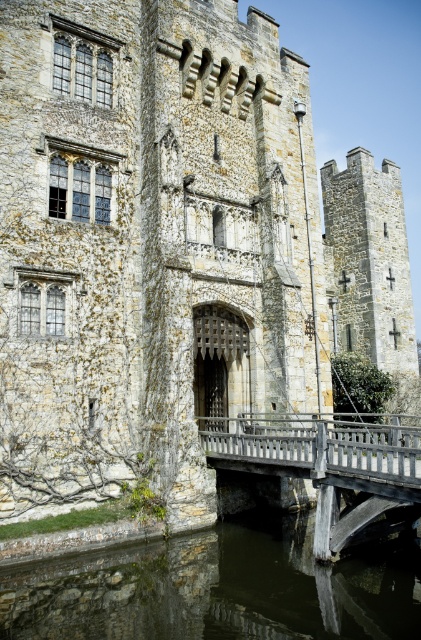
Is dark stone water at lower center above wooden bridge at center?

No.

Is point (391, 634) behind point (218, 420)?

No, (391, 634) is in front of (218, 420).

Is point (245, 586) behind point (386, 465)?

That is False.

You are a GUI agent. You are given a task and a screenshot of the screen. Output one action in this format:
    pyautogui.click(x=<x>, y=<y>)
    Task: Click on the dark stone water at lower center
    This screenshot has width=421, height=640.
    Given the screenshot: What is the action you would take?
    pyautogui.click(x=215, y=589)